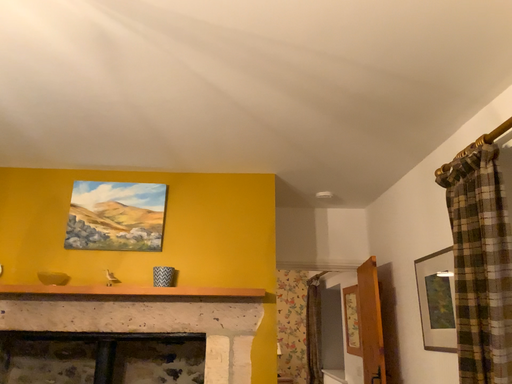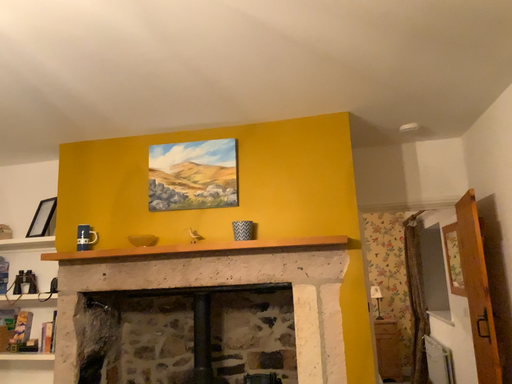
Question: How did the camera likely rotate when shooting the video?

Choices:
 (A) rotated right
 (B) rotated left

Answer: (B)